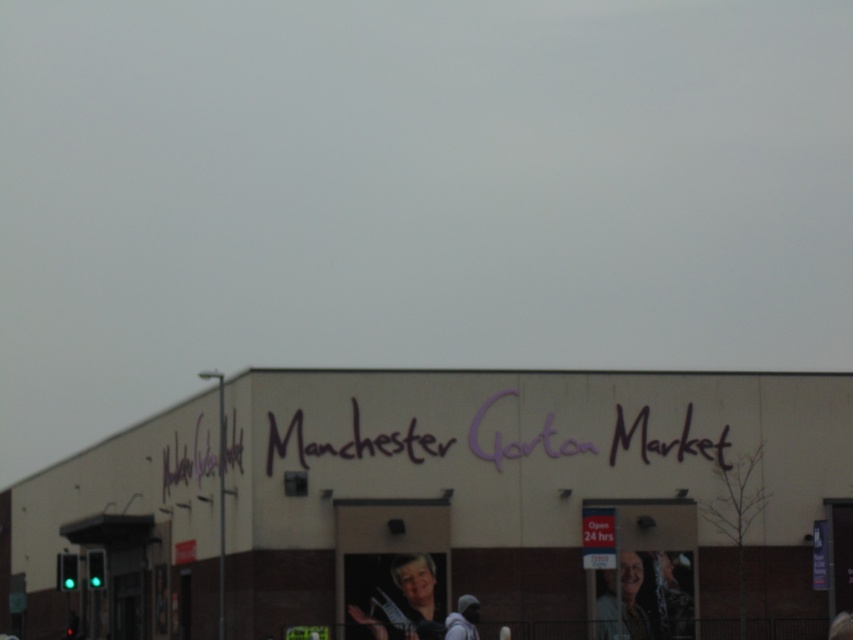
You are standing in front of the Manchester Gorton Market building. There are two points marked on the building wall. The first point is at coordinates point (689, 580) and the second is at point (370, 566). Which point is closer to you?

Point (370, 566) is closer to you because it is less further to the camera than point (689, 580).

You are a photographer trying to capture a photo of the white matte building at center and the matte black jacket at lower center. Since you want both objects to appear clearly in the frame, which one should you focus on first to ensure proper depth of field?

The white matte building at center is much taller than the matte black jacket at lower center, so focusing on the building first will help ensure both are in focus due to its larger size and distance.

You are standing in front of the Manchester Gorton Market building and want to take a photo that includes both the purple cursive sign and the smaller red sign. Which of the two points, point 1 at coordinates (364, 573) or point 2 at (627, 588), would be closer to the camera to ensure both signs are in focus?

Point 1 at coordinates (364, 573) is closer to the camera than point 2 at (627, 588), so focusing on point 1 would help keep both signs in focus since it is nearer.